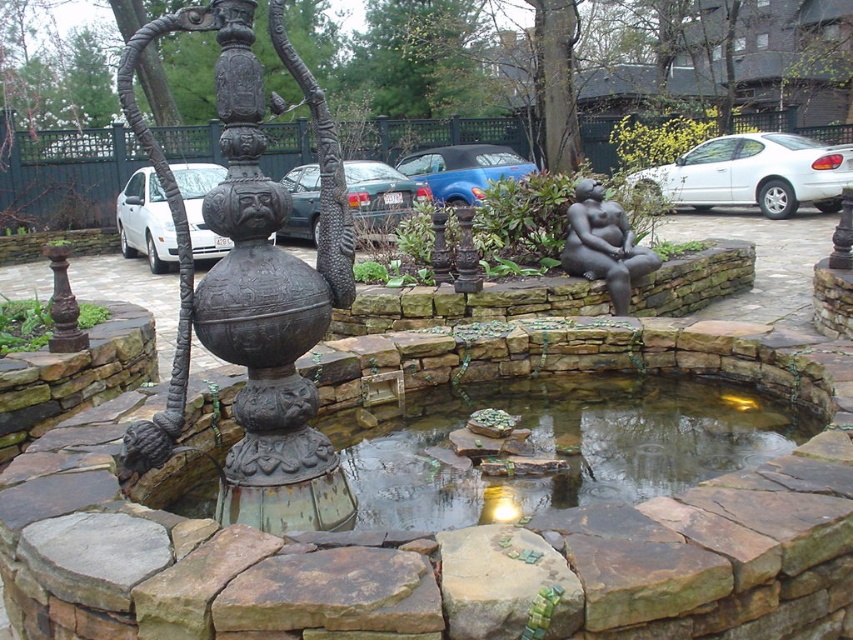
Does point (167, 212) lie behind point (451, 170)?

No, it is not.

Does point (160, 188) lie in front of point (461, 193)?

Yes.

This screenshot has height=640, width=853. Find the location of `white matte car at left`. white matte car at left is located at coordinates (144, 220).

Is point (283, 176) less distant than point (448, 172)?

That is False.

Is metallic blue sedan at center to the right of blue metallic car at center from the viewer's perspective?

No, metallic blue sedan at center is not to the right of blue metallic car at center.

From the picture: Who is more forward, (401, 180) or (450, 179)?

Point (401, 180) is more forward.

Locate an element on the screen. The width and height of the screenshot is (853, 640). metallic blue sedan at center is located at coordinates (379, 195).

Who is taller, white matte car at left or matte bronze statue at center?

matte bronze statue at center

Is white matte car at left above matte bronze statue at center?

Indeed, white matte car at left is positioned over matte bronze statue at center.

At what (x,y) coordinates should I click in order to perform the action: click on white matte car at left. Please return your answer as a coordinate pair (x, y). Looking at the image, I should click on (144, 220).

Locate an element on the screen. The width and height of the screenshot is (853, 640). white matte car at left is located at coordinates (144, 220).